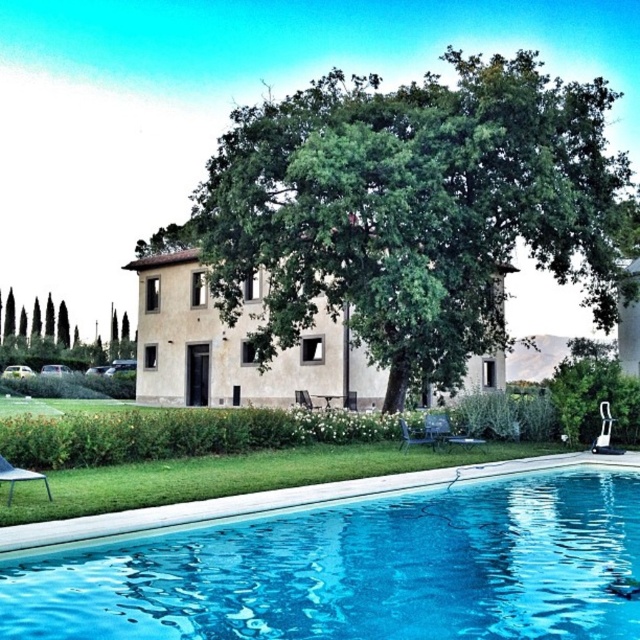
You are standing at the edge of the swimming pool and want to walk to the building. There are two points marked on the path. Which point, point [477,628] or point [323,310], is closer to you as you start walking towards the building?

Point [477,628] is closer to the viewer than point [323,310], so you will reach point [477,628] first as you walk towards the building.

You are planning to install a new fence around the property. Given the space between the green leafy tree at center and the beige stucco villa at center, can you determine which one requires more horizontal space for its base?

The green leafy tree at center requires more horizontal space for its base since its width surpasses that of the beige stucco villa at center.

You are standing in the garden and see two green leafy trees. One is labeled as the green leafy tree at center and the other as the green leafy tree at left. Which tree is situated to the right of the other?

The green leafy tree at center is positioned on the right side of green leafy tree at left.